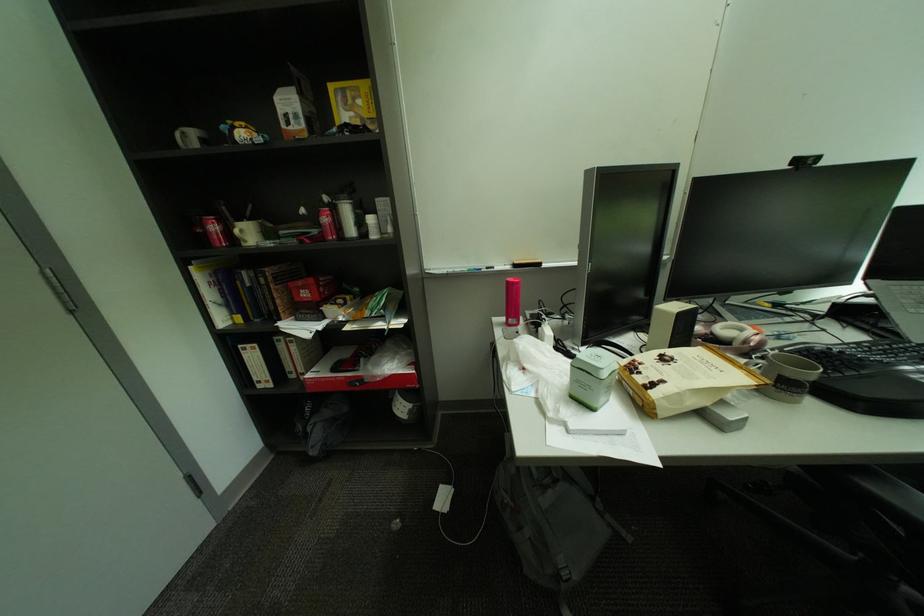
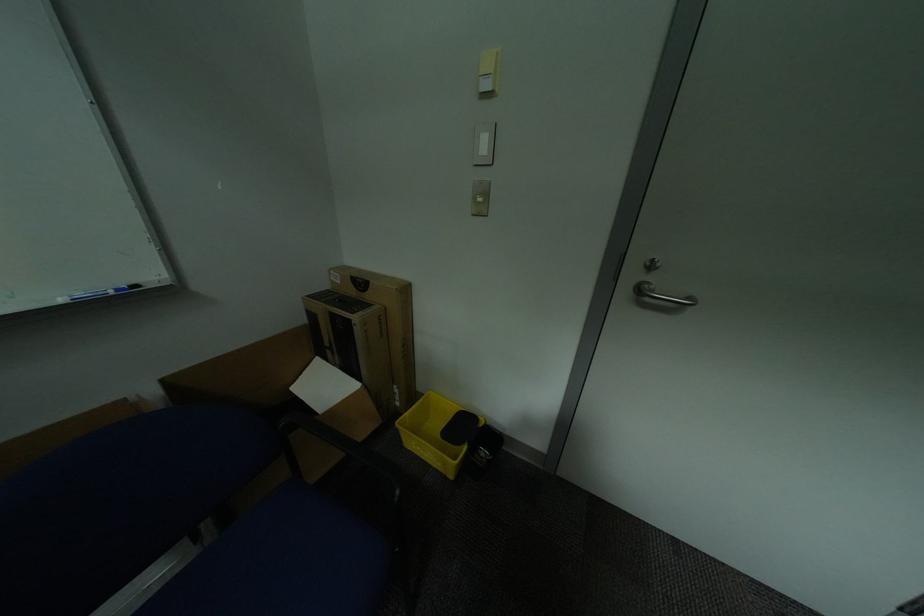
How did the camera likely rotate?

The camera's rotation is toward left-down.